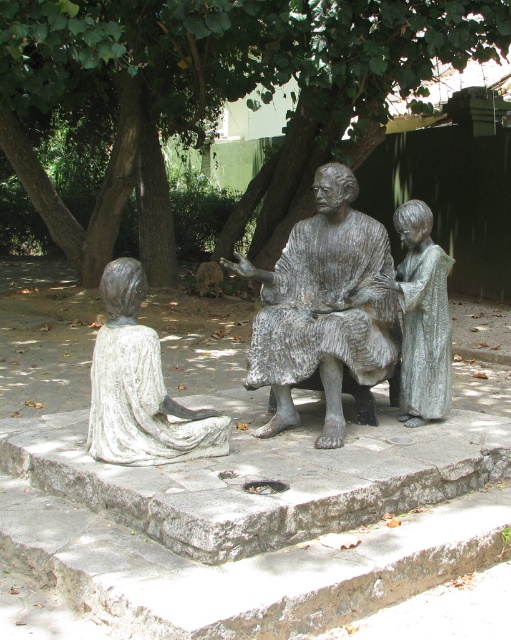
Is green leafy tree at center below bronze textured figure at center?

No, green leafy tree at center is not below bronze textured figure at center.

Who is higher up, green leafy tree at center or bronze textured figure at center?

green leafy tree at center is above.

Identify the location of green leafy tree at center. Image resolution: width=511 pixels, height=640 pixels. (223, 84).

Where is `green leafy tree at center`? green leafy tree at center is located at coordinates (223, 84).

Between green leafy tree at center and shiny silver statue at right, which one has more height?

With more height is shiny silver statue at right.

Is green leafy tree at center thinner than shiny silver statue at right?

No, green leafy tree at center is not thinner than shiny silver statue at right.

Who is more forward, (31, 19) or (416, 237)?

Point (416, 237) is more forward.

Where is `green leafy tree at center`? Image resolution: width=511 pixels, height=640 pixels. green leafy tree at center is located at coordinates (223, 84).

Does white marble statue at lower left have a lesser width compared to shiny silver statue at right?

No, white marble statue at lower left is not thinner than shiny silver statue at right.

Who is lower down, white marble statue at lower left or shiny silver statue at right?

white marble statue at lower left

Which is in front, point (106, 456) or point (410, 376)?

Point (106, 456)

Find the location of a particular element. This screenshot has height=640, width=511. white marble statue at lower left is located at coordinates (140, 387).